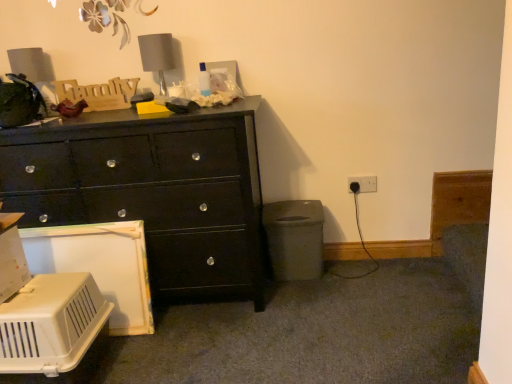
Question: Is the position of black glossy chest of drawers at left less distant than that of gray fabric lampshade at upper center?

Choices:
 (A) no
 (B) yes

Answer: (B)

Question: Considering the relative sizes of black glossy chest of drawers at left and gray fabric lampshade at upper center in the image provided, is black glossy chest of drawers at left smaller than gray fabric lampshade at upper center?

Choices:
 (A) yes
 (B) no

Answer: (B)

Question: Is black glossy chest of drawers at left not within gray fabric lampshade at upper center?

Choices:
 (A) yes
 (B) no

Answer: (A)

Question: Is black glossy chest of drawers at left further to the viewer compared to gray fabric lampshade at upper center?

Choices:
 (A) yes
 (B) no

Answer: (B)

Question: Would you say black glossy chest of drawers at left contains gray fabric lampshade at upper center?

Choices:
 (A) yes
 (B) no

Answer: (B)

Question: Are black glossy chest of drawers at left and gray fabric lampshade at upper center located far from each other?

Choices:
 (A) no
 (B) yes

Answer: (A)

Question: Is white plastic pet carrier at lower left thinner than black plastic electric outlet at lower right?

Choices:
 (A) yes
 (B) no

Answer: (B)

Question: Can you confirm if white plastic pet carrier at lower left is positioned to the left of black plastic electric outlet at lower right?

Choices:
 (A) no
 (B) yes

Answer: (B)

Question: Is white plastic pet carrier at lower left behind black plastic electric outlet at lower right?

Choices:
 (A) no
 (B) yes

Answer: (A)

Question: Is black plastic electric outlet at lower right completely or partially inside white plastic pet carrier at lower left?

Choices:
 (A) yes
 (B) no

Answer: (B)

Question: Would you say white plastic pet carrier at lower left is a long distance from black plastic electric outlet at lower right?

Choices:
 (A) yes
 (B) no

Answer: (A)

Question: From the image's perspective, is white plastic pet carrier at lower left below black plastic electric outlet at lower right?

Choices:
 (A) no
 (B) yes

Answer: (B)

Question: Does black glossy chest of drawers at left touch black plastic electric outlet at lower right?

Choices:
 (A) yes
 (B) no

Answer: (B)